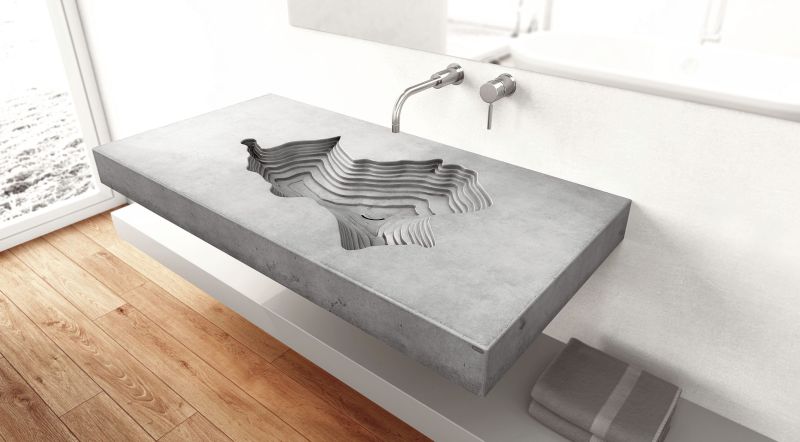
I want to click on top grey towel, so [x=610, y=384].